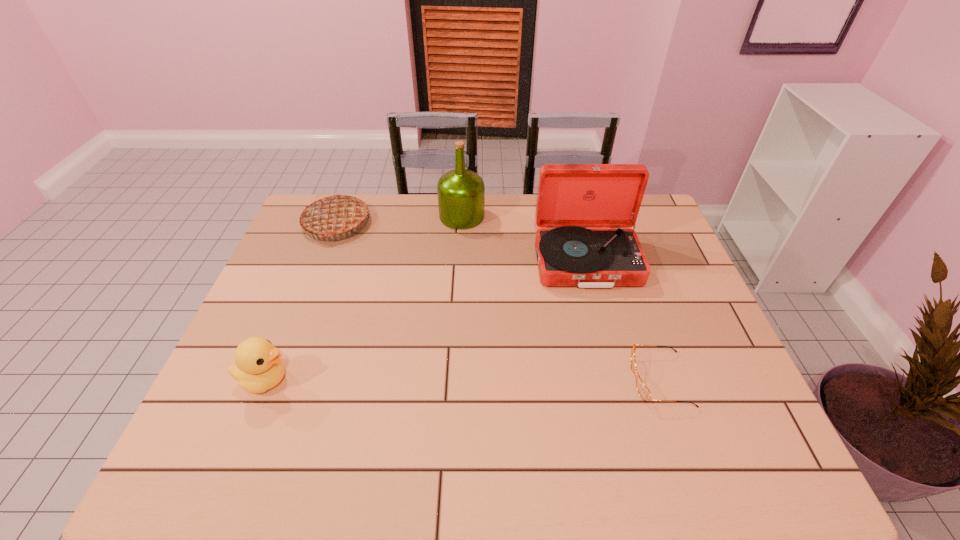
Where is `free space between the duck and the spectacles`? Image resolution: width=960 pixels, height=540 pixels. free space between the duck and the spectacles is located at coordinates (463, 380).

You are a GUI agent. You are given a task and a screenshot of the screen. Output one action in this format:
    pyautogui.click(x=<x>, y=<y>)
    Task: Click on the free space between the duck and the phonograph_record
    
    Given the screenshot: What is the action you would take?
    pyautogui.click(x=425, y=321)

Identify the location of blank region between the olive oil and the duck. This screenshot has width=960, height=540. (364, 298).

Where is `empty space between the olive oil and the pie`? The width and height of the screenshot is (960, 540). empty space between the olive oil and the pie is located at coordinates (399, 220).

Find the location of a particular element. free space between the olive oil and the shortest object is located at coordinates (561, 298).

The height and width of the screenshot is (540, 960). I want to click on object that ranks as the third closest to the phonograph_record, so click(x=335, y=214).

This screenshot has width=960, height=540. What are the coordinates of `object identified as the third closest to the third shortest object` in the screenshot? It's located at (584, 211).

At what (x,y) coordinates should I click in order to perform the action: click on vacant area that satisfies the following two spatial constraints: 1. on the front-facing side of the phonograph_record; 2. on the face of the duck. Please return your answer as a coordinate pair (x, y). The height and width of the screenshot is (540, 960). Looking at the image, I should click on (616, 380).